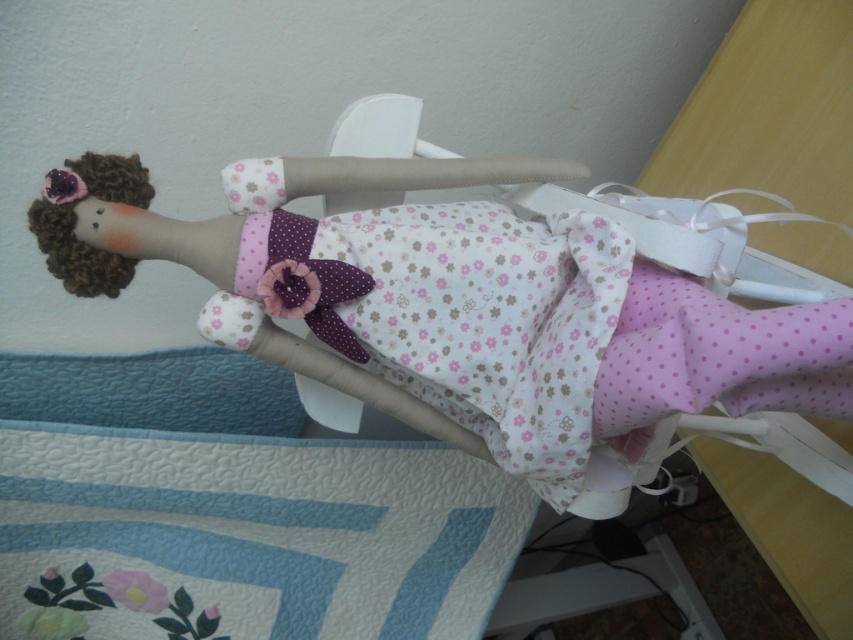
Based on the scene, where is the fluffy fabric doll at center positioned relative to the blue quilted fabric at lower left?

The fluffy fabric doll at center is to the right of the blue quilted fabric at lower left.

Looking at this image, you are a toy collector who wants to place a new decorative item between the fluffy fabric doll at center and the blue quilted fabric at lower left. If your item is 50 centimeters long, will it fit in the space between them?

The distance between the fluffy fabric doll at center and the blue quilted fabric at lower left is 47.85 centimeters. Since the item is 50 centimeters long, it will not fit in the space between them as it is longer than the available distance.